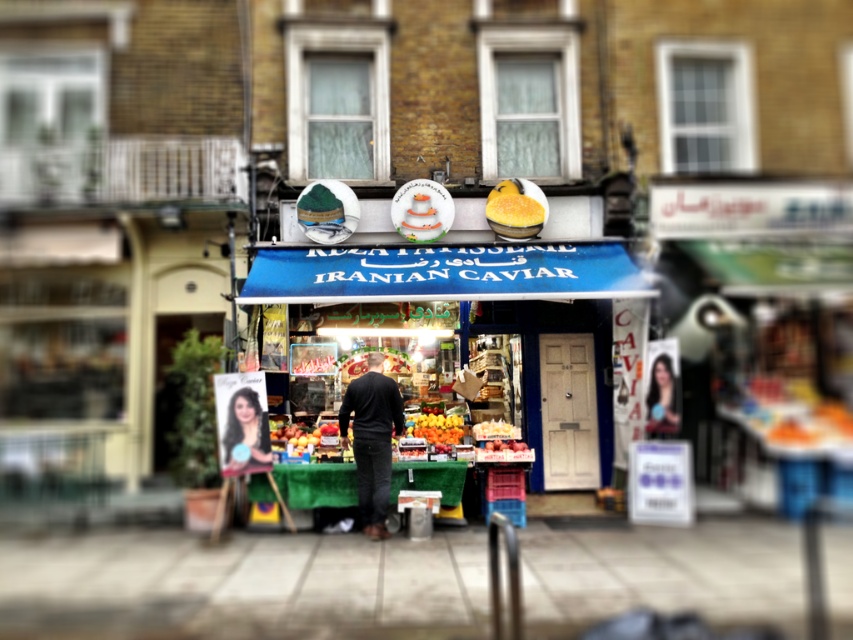
Based on the photo, you are a customer in the shop and want to place an order. You see the smooth skin portrait at lower left and the orange matte at center. Which item is narrower in width?

The smooth skin portrait at lower left is thinner than the orange matte at center, so it is narrower in width.

You are a delivery person who needs to place a yellow matte cake at center into a box that can only hold items narrower than the black matte jacket at center. Can you safely put the cake into the box?

The black matte jacket at center might be wider than the yellow matte cake at center, so it is uncertain if the cake will fit. Further measurement is needed to confirm.